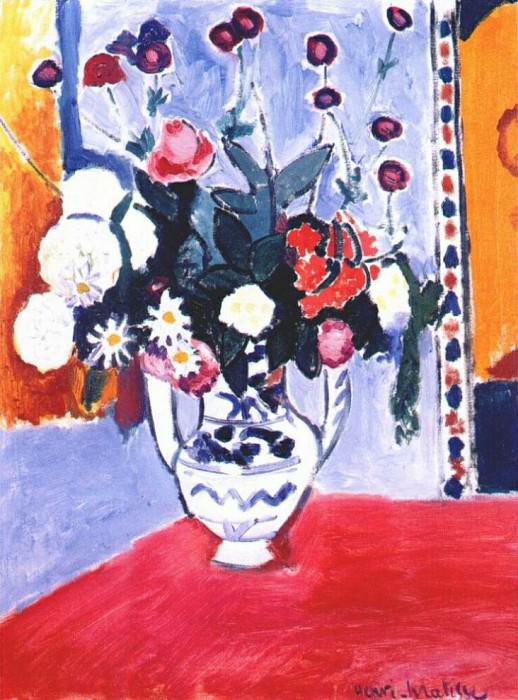
Identify the location of blue wall. (97, 530).